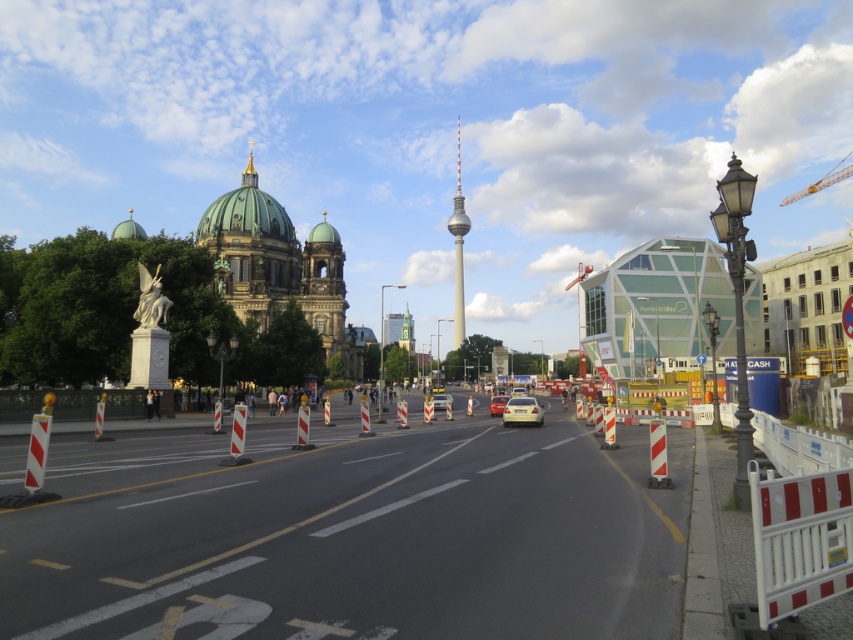
Is green stone dome at center positioned at the back of matte silver sedan at center?

No, green stone dome at center is closer to the viewer.

Who is positioned more to the left, green stone dome at center or matte silver sedan at center?

green stone dome at center

Which is in front, point (323, 257) or point (494, 396)?

Point (323, 257) is more forward.

Where is `green stone dome at center`? green stone dome at center is located at coordinates [277, 264].

Does white plastic barricades at center appear on the left side of green stone dome at center?

No, white plastic barricades at center is not to the left of green stone dome at center.

Which of these two, white plastic barricades at center or green stone dome at center, stands shorter?

With less height is white plastic barricades at center.

Between point (486, 465) and point (282, 257), which one is positioned behind?

The point (282, 257) is more distant.

Locate an element on the screen. The image size is (853, 640). white plastic barricades at center is located at coordinates point(352,536).

Is point (341, 307) positioned in front of point (440, 403)?

That is True.

Can you confirm if green stone dome at center is positioned above matte white sedan at center?

Yes, green stone dome at center is above matte white sedan at center.

The image size is (853, 640). Identify the location of green stone dome at center. (277, 264).